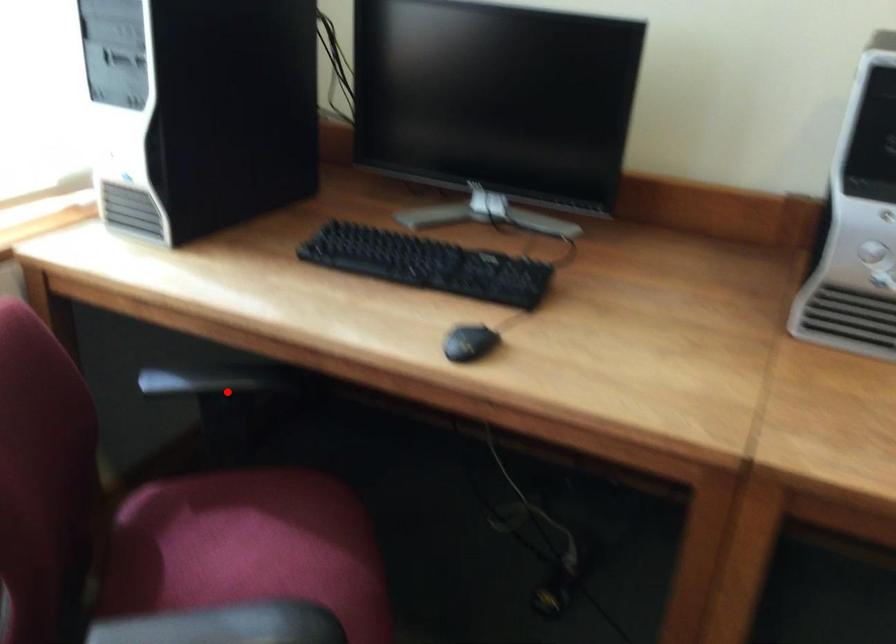
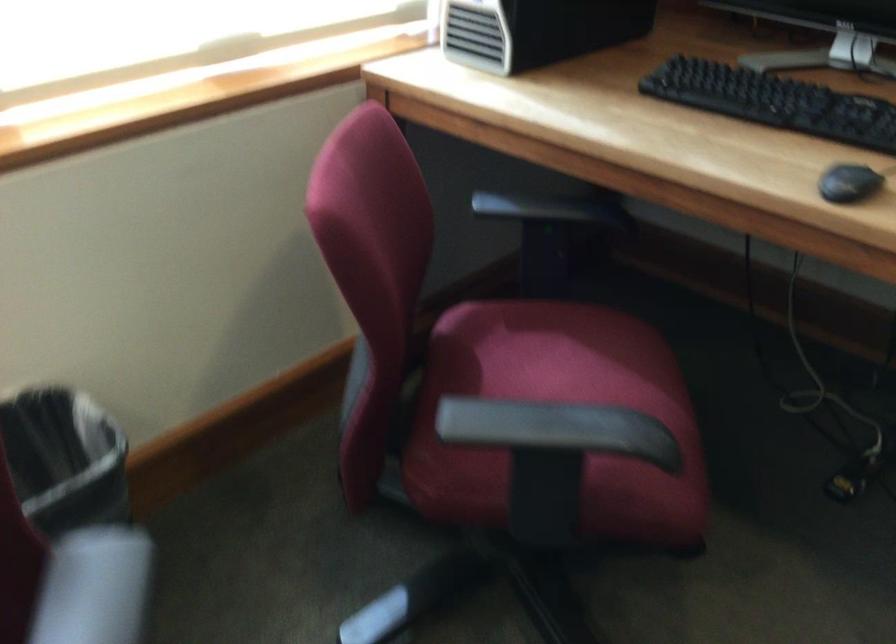
In the second image, find the point that corresponds to the highlighted location in the first image.

(555, 216)